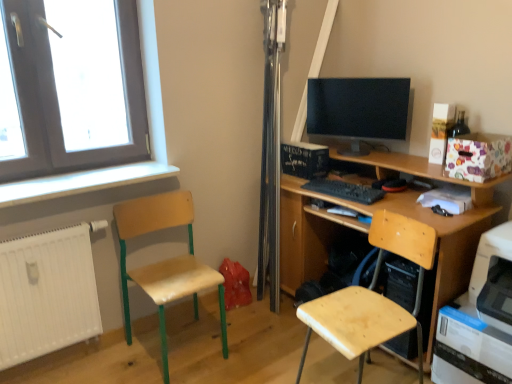
Identify the location of vacant space to the right of wooden seat at left, the 1th chair positioned from the left. (255, 345).